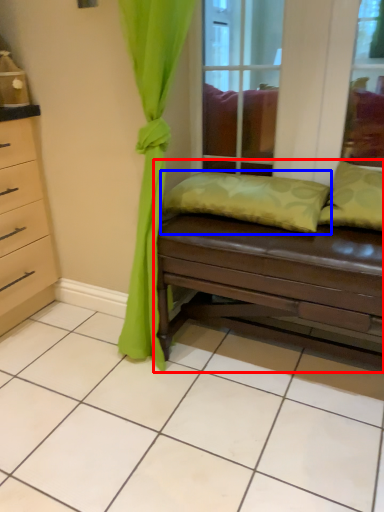
Question: Which of the following is the closest to the observer, studio couch (highlighted by a red box) or pillow (highlighted by a blue box)?

Choices:
 (A) studio couch
 (B) pillow

Answer: (A)